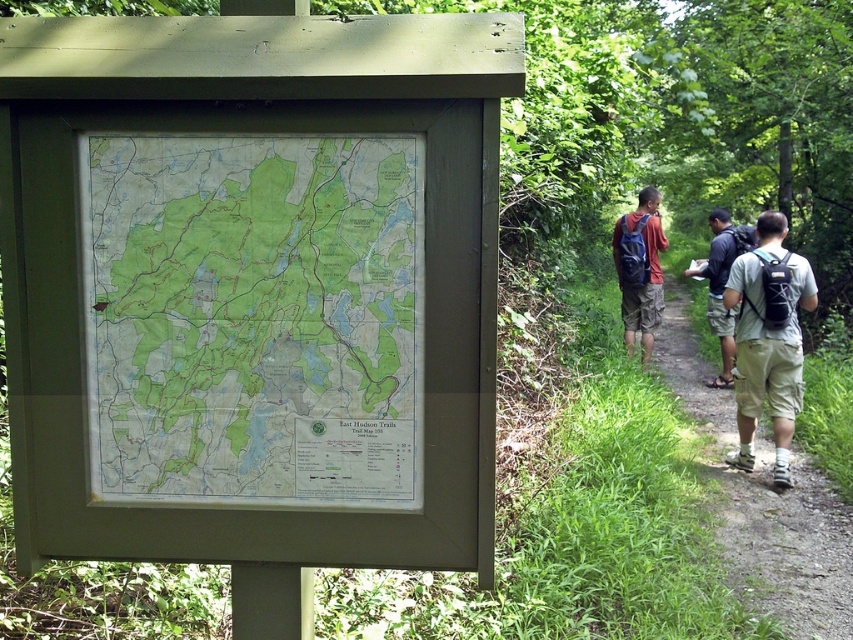
Question: Is khaki cotton shorts at right positioned in front of blue backpack at center?

Choices:
 (A) no
 (B) yes

Answer: (B)

Question: Which point is closer to the camera taking this photo?

Choices:
 (A) click(x=410, y=481)
 (B) click(x=808, y=576)
 (C) click(x=798, y=284)
 (D) click(x=646, y=342)

Answer: (A)

Question: Does blue backpack at center appear over dark gray backpack at center?

Choices:
 (A) yes
 (B) no

Answer: (A)

Question: Can you confirm if green paper map at center is positioned to the left of brown dirt path at center?

Choices:
 (A) yes
 (B) no

Answer: (A)

Question: Which point appears closest to the camera in this image?

Choices:
 (A) (715, 241)
 (B) (792, 515)

Answer: (B)

Question: Which object appears farthest from the camera in this image?

Choices:
 (A) khaki cotton shorts at right
 (B) blue backpack at center
 (C) brown dirt path at center

Answer: (B)